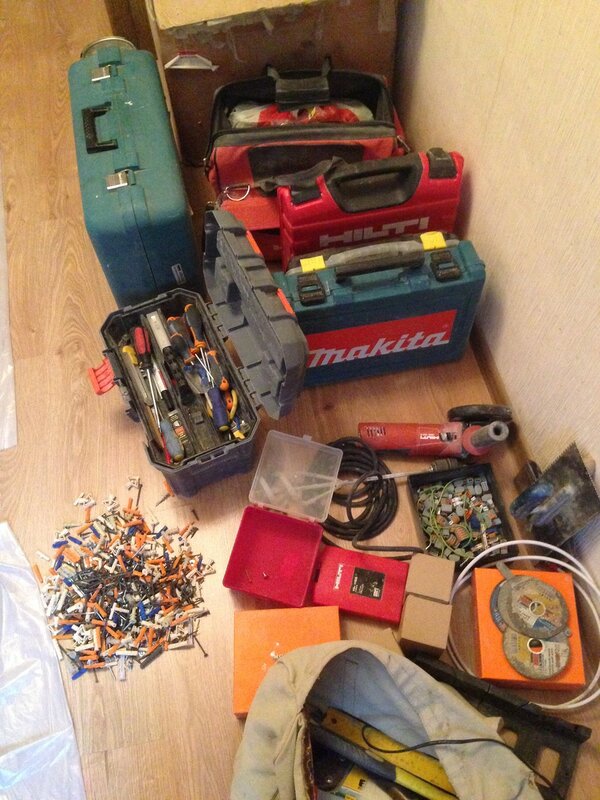
Where is `1 white cord`? 1 white cord is located at coordinates (582, 694).